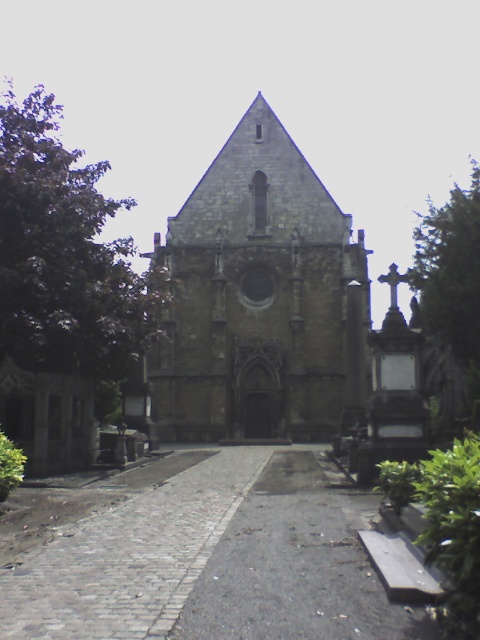
Can you confirm if cobblestone path at center is positioned to the right of stone gothic church at center?

No, cobblestone path at center is not to the right of stone gothic church at center.

Who is shorter, cobblestone path at center or stone gothic church at center?

cobblestone path at center is shorter.

I want to click on cobblestone path at center, so click(199, 554).